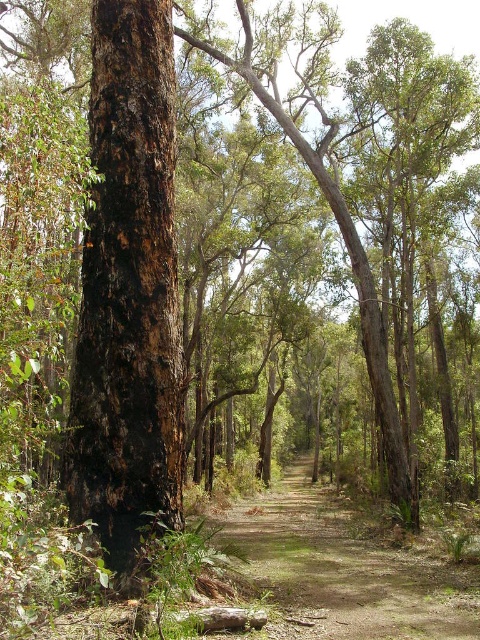
Is dark brown bark tree at center to the left of brown dirt track at center from the viewer's perspective?

Correct, you'll find dark brown bark tree at center to the left of brown dirt track at center.

Is point (142, 502) positioned after point (478, 577)?

No, (142, 502) is closer to viewer.

Where is `dark brown bark tree at center`? The width and height of the screenshot is (480, 640). dark brown bark tree at center is located at coordinates (128, 291).